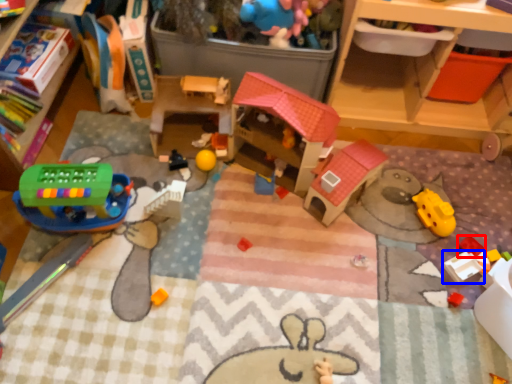
Question: Which point is further to the camera, toy (highlighted by a red box) or toy (highlighted by a blue box)?

Choices:
 (A) toy
 (B) toy

Answer: (A)